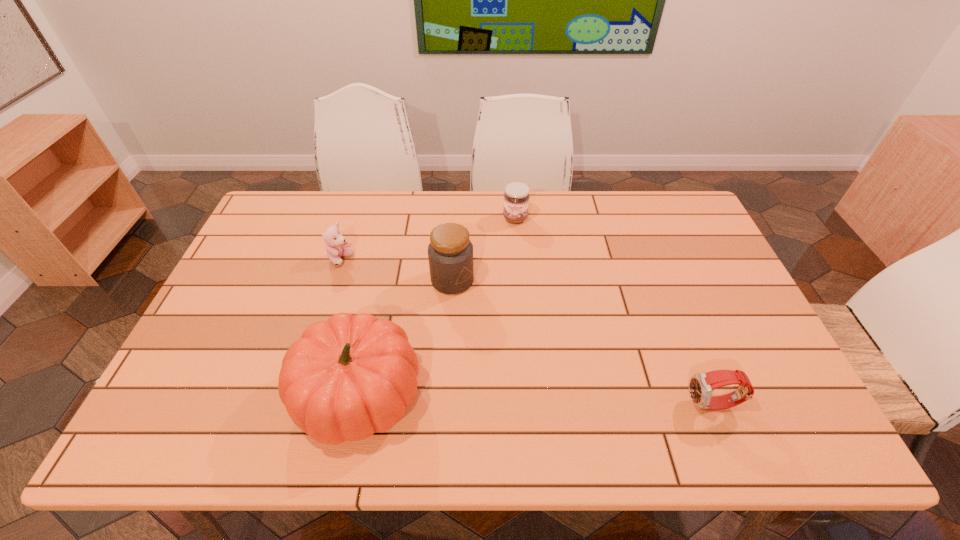
Find the location of a particular element. This screenshot has height=540, width=960. pumpkin is located at coordinates (344, 379).

You are a GUI agent. You are given a task and a screenshot of the screen. Output one action in this format:
    pyautogui.click(x=<x>, y=<y>)
    Task: Click on the watch
    This screenshot has height=540, width=960.
    Given the screenshot: What is the action you would take?
    pyautogui.click(x=701, y=385)

This screenshot has height=540, width=960. Identify the location of jam. (516, 196).

The image size is (960, 540). In order to click on the farthest object in this screenshot , I will do `click(516, 196)`.

Where is `teddy bear`? The width and height of the screenshot is (960, 540). teddy bear is located at coordinates (336, 245).

This screenshot has height=540, width=960. What are the coordinates of `jar` in the screenshot? It's located at (450, 253).

In order to click on vacant area located 0.340m on the back of the pumpkin in this screenshot , I will do `click(387, 255)`.

Locate an element on the screen. The width and height of the screenshot is (960, 540). free space located on the face of the rightmost object is located at coordinates coord(549,406).

This screenshot has width=960, height=540. Find the location of `vacant point located on the face of the rightmost object`. vacant point located on the face of the rightmost object is located at coordinates (558, 406).

Locate an element on the screen. blank area located on the face of the rightmost object is located at coordinates (575, 406).